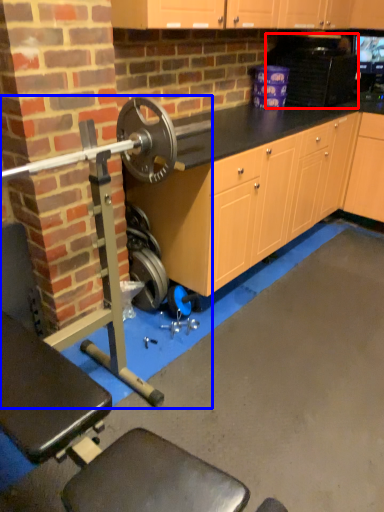
Question: Which object is closer to the camera taking this photo, appliance (highlighted by a red box) or barbell (highlighted by a blue box)?

Choices:
 (A) appliance
 (B) barbell

Answer: (B)